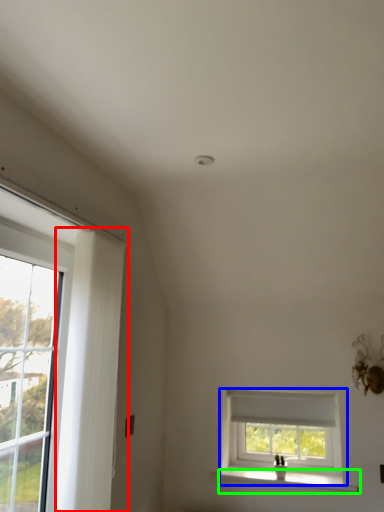
Question: Which is farther away from curtain (highlighted by a red box)? window (highlighted by a blue box) or window sill (highlighted by a green box)?

Choices:
 (A) window
 (B) window sill

Answer: (B)